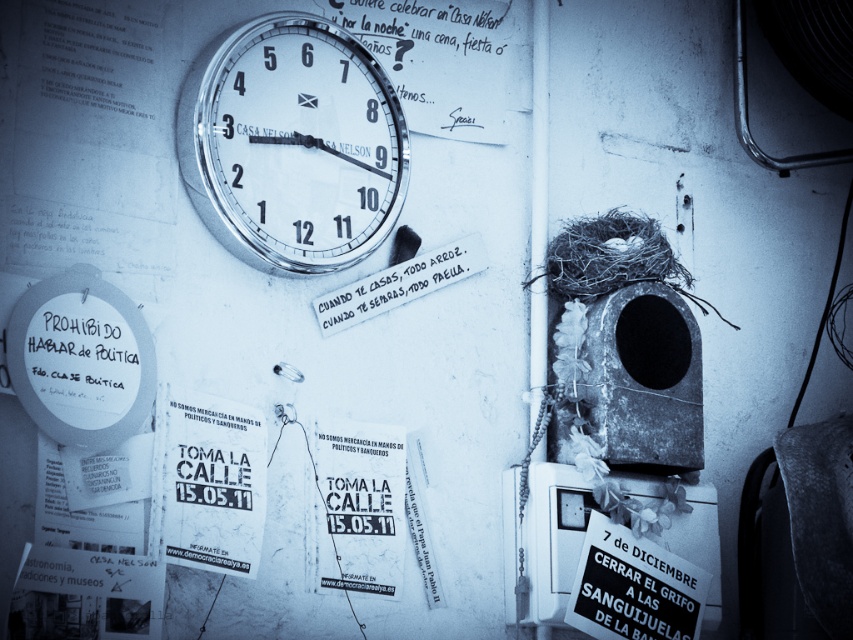
You are an observer looking at the wall in the image. There is a matte white sign at left and a matte white text at center. Which object is located lower on the wall?

The matte white sign at left is positioned under the matte white text at center, so it is located lower on the wall.

Based on the scene description, where is the metallic clock at upper center located in the image?

The metallic clock at upper center is located at point (292, 145).

You are an interior designer who wants to hang a new decorative item on the wall between the metallic clock at upper center and the matte white sign at left. Based on their positions, where should you place the new item to maintain symmetry?

The metallic clock at upper center is above the matte white sign at left, so placing the new item between them would require positioning it below the clock and above the sign to maintain symmetry.